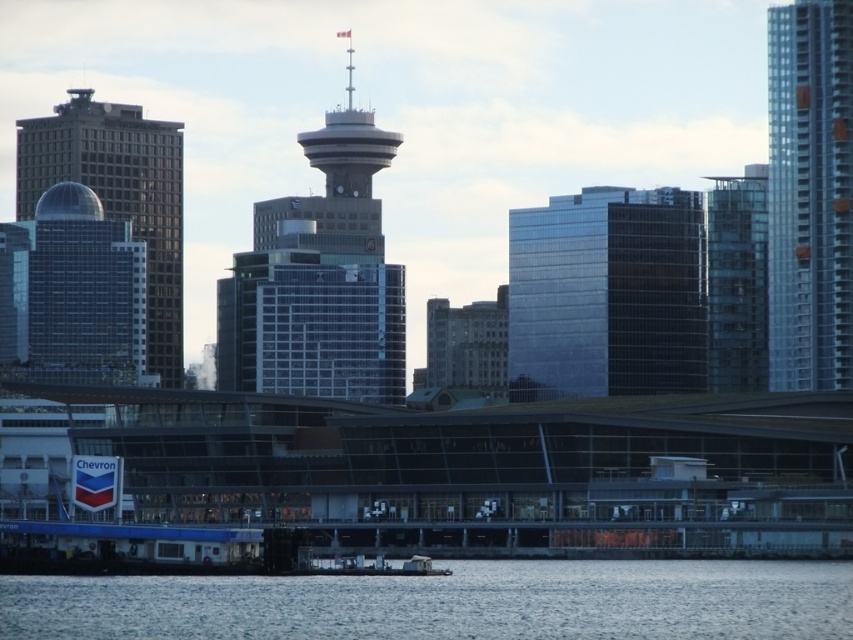
Question: Is clear glass skyscraper at right to the left of metallic gray boat at lower center from the viewer's perspective?

Choices:
 (A) no
 (B) yes

Answer: (A)

Question: Can you confirm if shiny glass building at center is positioned to the left of brown stone building at center?

Choices:
 (A) yes
 (B) no

Answer: (B)

Question: Which point is closer to the camera?

Choices:
 (A) blue water at lower center
 (B) clear glass skyscraper at right

Answer: (A)

Question: Which point appears closest to the camera in this image?

Choices:
 (A) (786, 260)
 (B) (338, 113)
 (C) (642, 337)
 (D) (701, 636)

Answer: (D)

Question: In this image, where is glassy blue skyscraper at center located relative to glassy blue skyscraper at left?

Choices:
 (A) left
 (B) right

Answer: (B)

Question: Which object is farther from the camera taking this photo?

Choices:
 (A) brown stone building at center
 (B) blue water at lower center

Answer: (A)